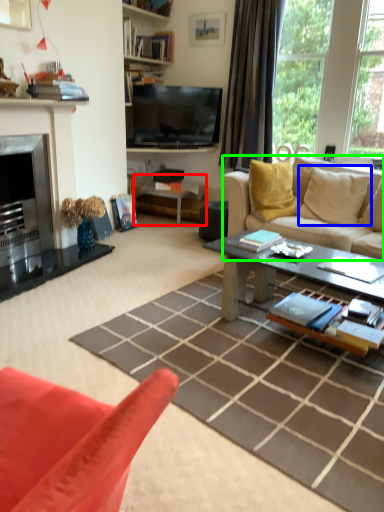
Question: Based on their relative distances, which object is farther from side table (highlighted by a red box)? Choose from pillow (highlighted by a blue box) and studio couch (highlighted by a green box).

Choices:
 (A) pillow
 (B) studio couch

Answer: (A)